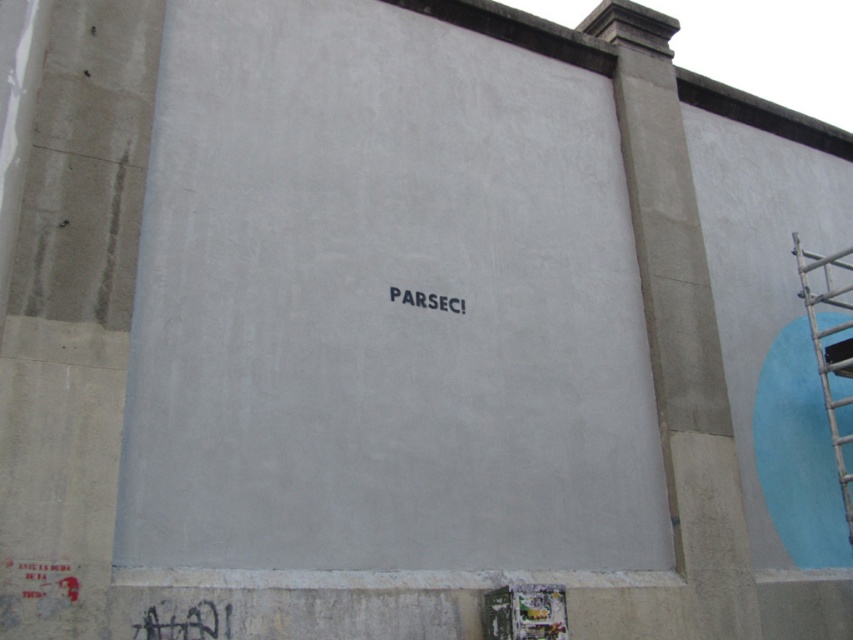
You are a painter standing on the wooden scaffolding at right. You need to reach the center of the wall to touch up the paint around the word PARSEC! Can you reach it from your current position?

The wooden scaffolding at right is located at point (822,349), which is near the bottom right corner of the wall. Since the center of the wall is much higher up, you would need to move to a higher platform or adjust your position to reach the center area where the word PARSEC! is located.

You are an artist planning to add a new mural next to the existing wall. You want to ensure that your new artwork doesn not block any existing elements. Based on the scene, which existing element on the wall is taller between the black graffiti at lower left and the black matte text at center?

The black graffiti at lower left is much taller than the black matte text at center, so it is the taller element on the wall.

You are an inspector checking the construction site. You need to compare the width of the wooden scaffolding at right and the black matte text at center. Which one is wider?

The wooden scaffolding at right is wider than the black matte text at center because its width surpasses the latter according to the description.